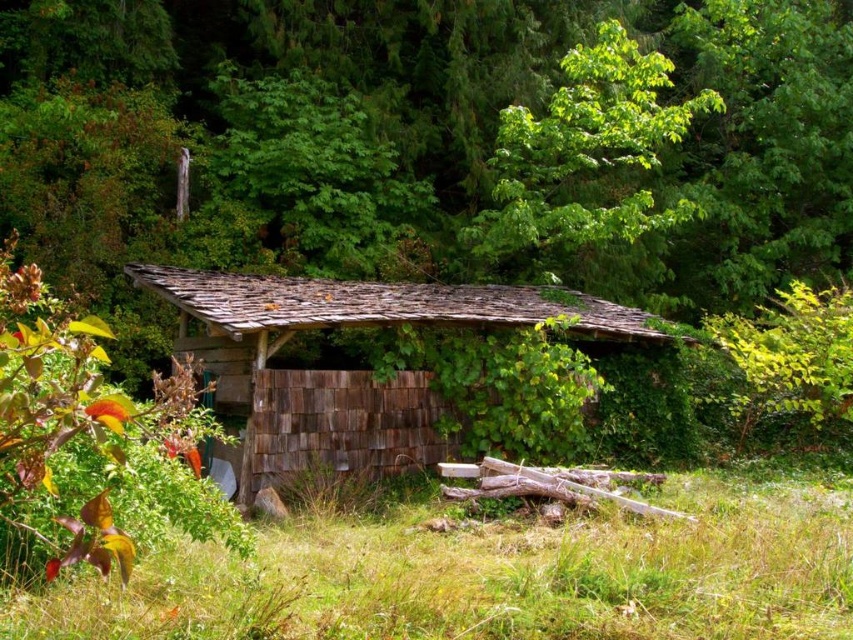
You are standing in front of the weathered wood hut at center and want to see the view beyond the green leafy tree at upper center. Can you see the tree blocking your view? Please explain based on their heights.

The weathered wood hut at center is shorter than the green leafy tree at upper center. Since the tree is taller, it may block your view depending on its position relative to you. However, the description only mentions their height comparison, not their exact positions. If the tree is directly in front of you, it could block the view, but if it is to the side, it might not.

You are a hiker who wants to set up a tent in the area shown. Considering the green grass at lower center and the weathered wood hut at center, which location would be more suitable for setting up your tent?

The green grass at lower center is positioned under the weathered wood hut at center, so setting up the tent there might be problematic due to the hut blocking sunlight and space. The area around the hut, away from the grass under it, would be more suitable for the tent.

You are standing in front of the weathered wood hut at center and want to walk to the green grass at lower center. Is the path between them wide enough for you to walk through comfortably?

The green grass at lower center has a width less than the weathered wood hut at center, so the path between them may be narrow. However, since the grass itself is at the lower center, it might still allow comfortable passage depending on the exact dimensions not specified. The description only mentions width comparison between the two objects, not the path width.